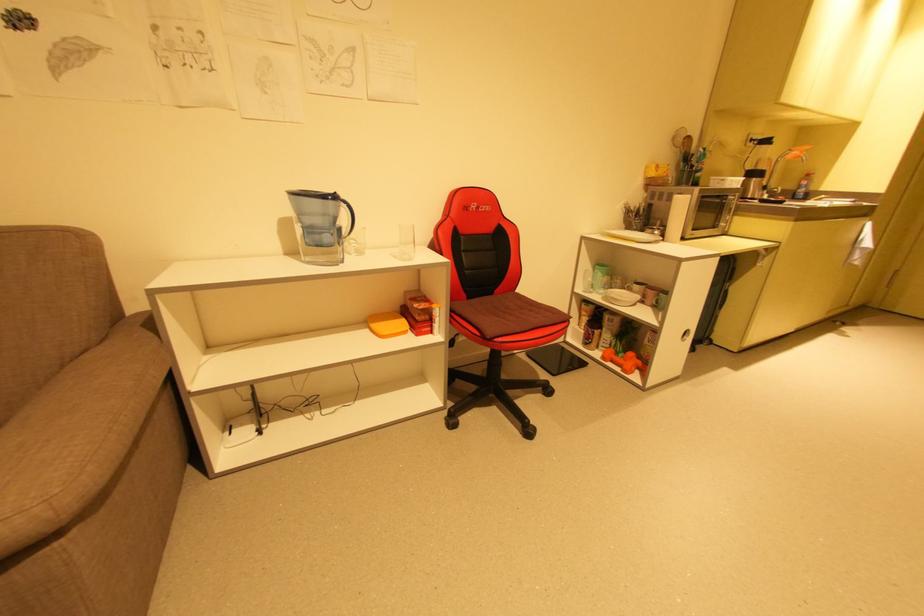
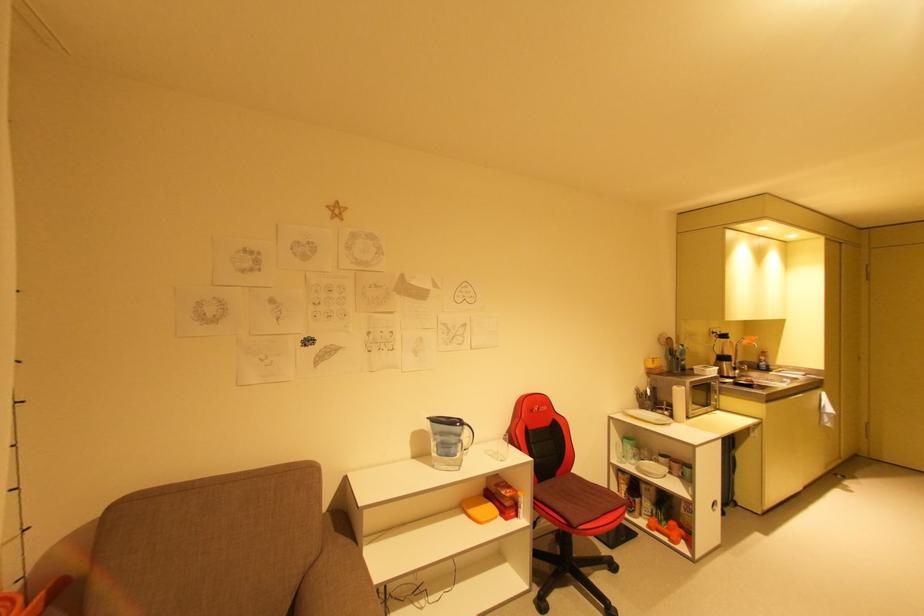
The point at (629, 368) is marked in the first image. Where is the corresponding point in the second image?

(675, 538)